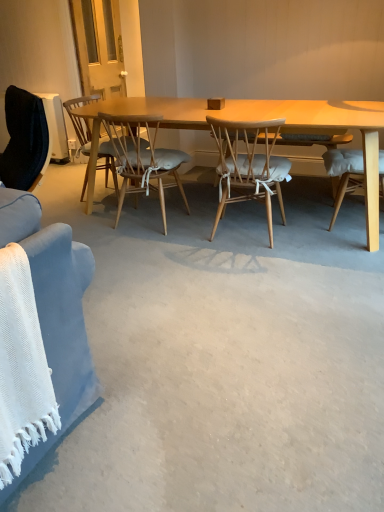
In order to click on unoccupied space behind light brown woven wood chair at center, placed as the 3th chair when sorted from left to right in this screenshot , I will do `click(227, 207)`.